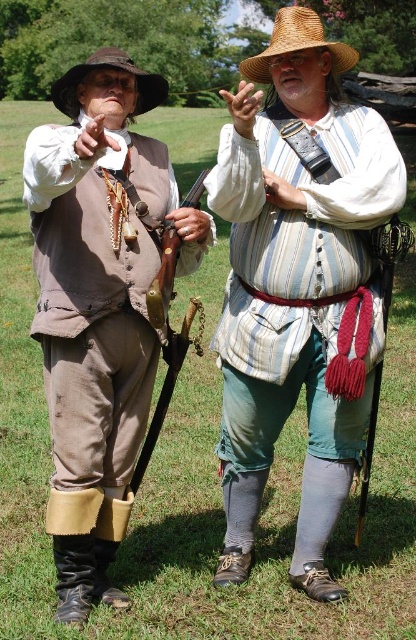
Question: Based on their relative distances, which object is nearer to the brown felt cowboy hat at upper left?

Choices:
 (A) striped fabric shirt at center
 (B) wooden rifle at center
 (C) strawhat at upper center

Answer: (A)

Question: Among these points, which one is farthest from the camera?

Choices:
 (A) (109, 497)
 (B) (61, 81)
 (C) (178, 250)
 (D) (274, 416)

Answer: (D)

Question: Is strawhat at upper center wider than wooden rifle at center?

Choices:
 (A) no
 (B) yes

Answer: (B)

Question: Estimate the real-world distances between objects in this image. Which object is farther from the wooden rifle at center?

Choices:
 (A) striped fabric shirt at center
 (B) matte brown vest at left

Answer: (A)

Question: Does striped fabric shirt at center have a larger size compared to wooden rifle at center?

Choices:
 (A) yes
 (B) no

Answer: (A)

Question: Observing the image, what is the correct spatial positioning of striped fabric shirt at center in reference to wooden rifle at center?

Choices:
 (A) below
 (B) above

Answer: (A)